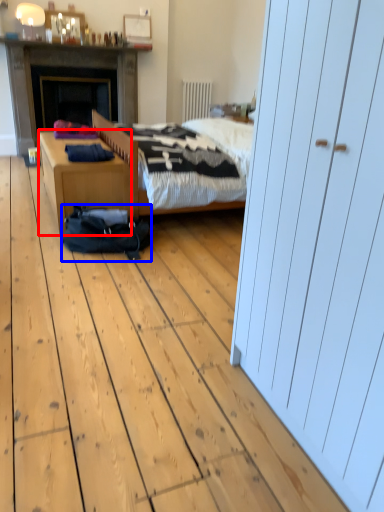
Question: Which of the following is the farthest to the observer, desk (highlighted by a red box) or sleeping bag (highlighted by a blue box)?

Choices:
 (A) desk
 (B) sleeping bag

Answer: (A)